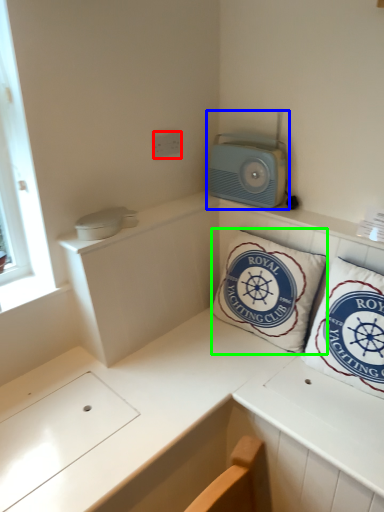
Question: Considering the real-world distances, which object is farthest from electric outlet (highlighted by a red box)? appliance (highlighted by a blue box) or pillow (highlighted by a green box)?

Choices:
 (A) appliance
 (B) pillow

Answer: (B)